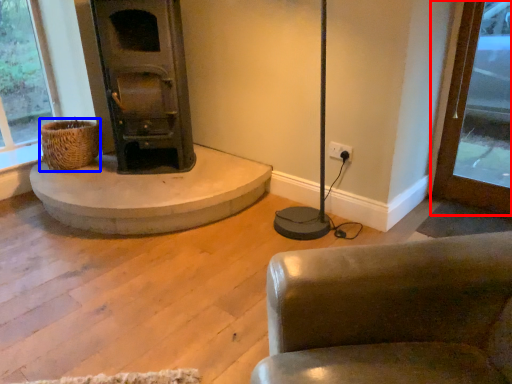
Question: Which object is closer to the camera taking this photo, window frame (highlighted by a red box) or basket (highlighted by a blue box)?

Choices:
 (A) window frame
 (B) basket

Answer: (A)